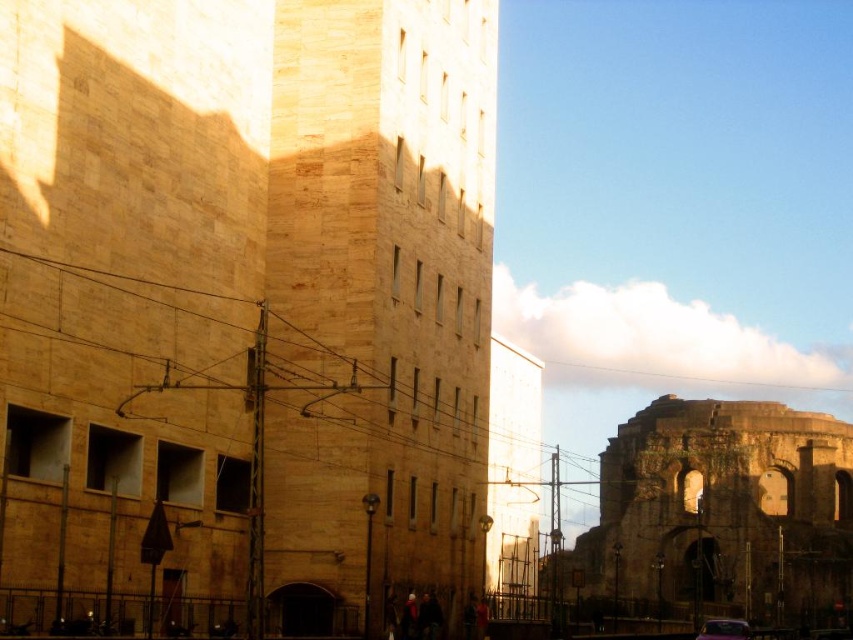
Question: Observing the image, what is the correct spatial positioning of beige stone tower at center in reference to metallic purple car at lower right?

Choices:
 (A) below
 (B) above

Answer: (B)

Question: Estimate the real-world distances between objects in this image. Which object is farther from the beige stone tower at center?

Choices:
 (A) metallic purple car at lower right
 (B) brown stone ruins at right

Answer: (B)

Question: Which is nearer to the beige stone tower at center?

Choices:
 (A) brown stone ruins at right
 (B) metallic purple car at lower right

Answer: (B)

Question: Can you confirm if beige stone tower at center is bigger than metallic purple car at lower right?

Choices:
 (A) no
 (B) yes

Answer: (B)

Question: Is brown stone ruins at right closer to the viewer compared to metallic purple car at lower right?

Choices:
 (A) yes
 (B) no

Answer: (B)

Question: Which object is the farthest from the brown stone ruins at right?

Choices:
 (A) metallic purple car at lower right
 (B) beige stone tower at center

Answer: (A)